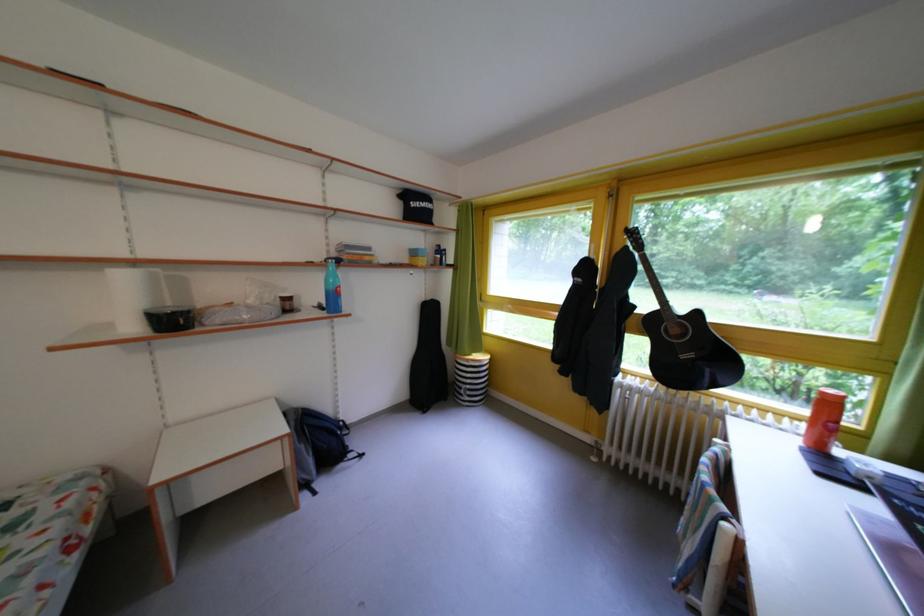
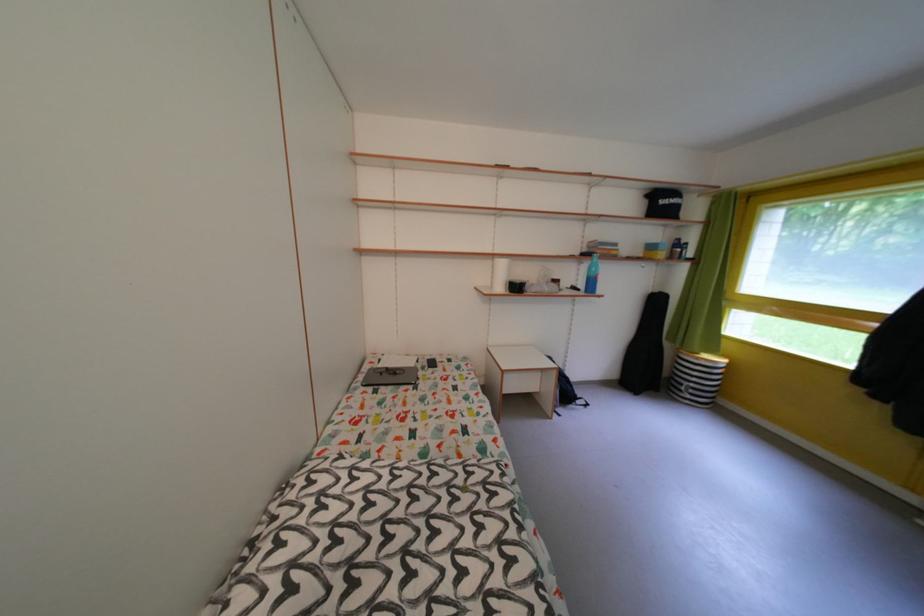
Question: How did the camera likely rotate?

Choices:
 (A) Left
 (B) Right
 (C) Up
 (D) Down

Answer: (A)